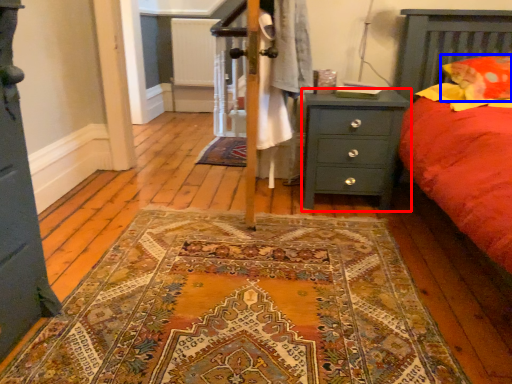
Question: Which point is further to the camera, nightstand (highlighted by a red box) or pillow (highlighted by a blue box)?

Choices:
 (A) nightstand
 (B) pillow

Answer: (A)